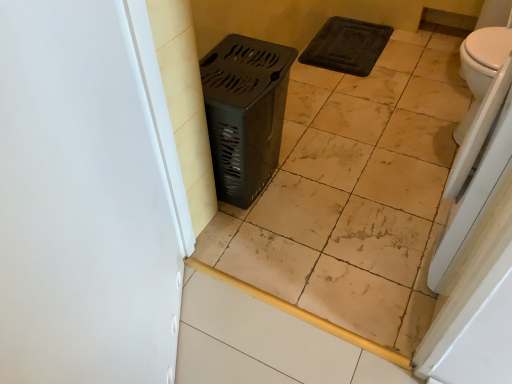
Describe the element at coordinates (481, 67) in the screenshot. The image size is (512, 384). I see `white glossy toilet at right` at that location.

Image resolution: width=512 pixels, height=384 pixels. What do you see at coordinates (245, 113) in the screenshot? I see `metallic gray laundry basket at center` at bounding box center [245, 113].

This screenshot has width=512, height=384. I want to click on white glossy toilet at right, so click(481, 67).

From the image's perspective, is white matte screen door at left under metallic gray laundry basket at center?

Yes.

Does point (80, 190) come farther from viewer compared to point (231, 168)?

No, (80, 190) is closer to viewer.

Between white matte screen door at left and metallic gray laundry basket at center, which one has smaller size?

With smaller size is white matte screen door at left.

Considering the relative positions of white matte screen door at left and metallic gray laundry basket at center in the image provided, is white matte screen door at left in front of metallic gray laundry basket at center?

Yes, white matte screen door at left is closer to the camera.

Is white matte screen door at left directly adjacent to white glossy toilet at right?

No, white matte screen door at left is not beside white glossy toilet at right.

Consider the image. Is white matte screen door at left oriented towards white glossy toilet at right?

Yes.

Locate an element on the screen. appliance above the white matte screen door at left (from the image's perspective) is located at coordinates (475, 171).

From the image's perspective, is white matte screen door at left positioned above or below white glossy toilet at right?

white matte screen door at left is below white glossy toilet at right.

Identify the location of toilet behind the beige ceramic tile at center. This screenshot has width=512, height=384. (481, 67).

Would you say white glossy toilet at right is part of beige ceramic tile at center's contents?

Actually, white glossy toilet at right is outside beige ceramic tile at center.

Which object is wider, metallic gray laundry basket at center or white glossy toilet at right?

metallic gray laundry basket at center is wider.

Which is correct: metallic gray laundry basket at center is inside white glossy toilet at right, or outside of it?

metallic gray laundry basket at center lies outside white glossy toilet at right.

Is metallic gray laundry basket at center beside white glossy toilet at right?

No.

Can you confirm if metallic gray laundry basket at center is bigger than white glossy toilet at right?

Yes, metallic gray laundry basket at center is bigger than white glossy toilet at right.

Consider the image. Does metallic gray laundry basket at center turn towards white glossy toilet at right?

No, metallic gray laundry basket at center does not turn towards white glossy toilet at right.

Which is behind, metallic gray laundry basket at center or white glossy toilet at right?

Positioned behind is white glossy toilet at right.

From a real-world perspective, is metallic gray laundry basket at center physically below white glossy toilet at right?

Correct, in the physical world, metallic gray laundry basket at center is lower than white glossy toilet at right.

Locate an element on the screen. toilet lying on the right of white glossy toilet at right is located at coordinates (481, 67).

From their relative heights in the image, would you say white glossy toilet at right is taller or shorter than white glossy toilet at right?

Clearly, white glossy toilet at right is taller compared to white glossy toilet at right.

Is white glossy toilet at right surrounded by white glossy toilet at right?

Definitely not — white glossy toilet at right is not inside white glossy toilet at right.

Based on the photo, in terms of width, does white matte screen door at left look wider or thinner when compared to white glossy toilet at right?

Clearly, white matte screen door at left has less width compared to white glossy toilet at right.

Considering the positions of objects white matte screen door at left and white glossy toilet at right in the image provided, who is more to the right, white matte screen door at left or white glossy toilet at right?

Positioned to the right is white glossy toilet at right.

Could you tell me if white matte screen door at left is facing white glossy toilet at right?

No, white matte screen door at left is not oriented towards white glossy toilet at right.

The width and height of the screenshot is (512, 384). I want to click on laundry basket above the white matte screen door at left (from the image's perspective), so click(x=245, y=113).

Identify the location of screen door that appears below the white glossy toilet at right (from the image's perspective). (87, 197).

Looking at the image, which one is located further to beige ceramic tile at center, white glossy toilet at right or white matte screen door at left?

white matte screen door at left is further to beige ceramic tile at center.

From the picture: Based on their spatial positions, is white glossy toilet at right or metallic gray laundry basket at center closer to beige ceramic tile at center?

Based on the image, metallic gray laundry basket at center appears to be nearer to beige ceramic tile at center.

Looking at the image, which one is located further to beige ceramic tile at center, white matte screen door at left or white glossy toilet at right?

white matte screen door at left is positioned further to the anchor beige ceramic tile at center.

Looking at the image, which one is located closer to white matte screen door at left, white glossy toilet at right or metallic gray laundry basket at center?

metallic gray laundry basket at center.

Which object lies nearer to the anchor point beige ceramic tile at center, white glossy toilet at right or metallic gray laundry basket at center?

Among the two, metallic gray laundry basket at center is located nearer to beige ceramic tile at center.

Looking at the image, which one is located closer to metallic gray laundry basket at center, white glossy toilet at right or beige ceramic tile at center?

Based on the image, beige ceramic tile at center appears to be nearer to metallic gray laundry basket at center.

From the image, which object appears to be nearer to white glossy toilet at right, white matte screen door at left or beige ceramic tile at center?

Among the two, beige ceramic tile at center is located nearer to white glossy toilet at right.

Which object lies nearer to the anchor point metallic gray laundry basket at center, white glossy toilet at right or white matte screen door at left?

Among the two, white matte screen door at left is located nearer to metallic gray laundry basket at center.

This screenshot has height=384, width=512. I want to click on appliance between white matte screen door at left and white glossy toilet at right in the front-back direction, so click(475, 171).

Where is `ceramic tile located between metallic gray laundry basket at center and white glossy toilet at right in the left-right direction`? The height and width of the screenshot is (384, 512). ceramic tile located between metallic gray laundry basket at center and white glossy toilet at right in the left-right direction is located at coordinates click(355, 192).

This screenshot has height=384, width=512. What are the coordinates of `laundry basket located between white matte screen door at left and white glossy toilet at right in the depth direction` in the screenshot? It's located at (245, 113).

Locate an element on the screen. This screenshot has width=512, height=384. ceramic tile between metallic gray laundry basket at center and white glossy toilet at right is located at coordinates (355, 192).